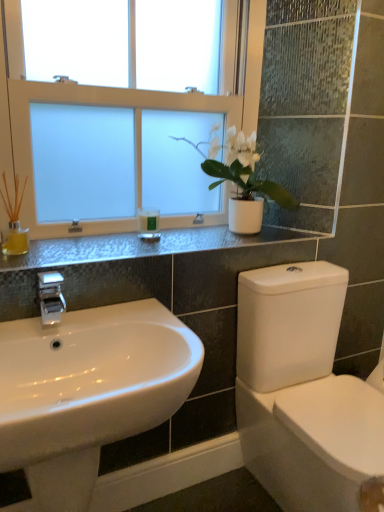
Find the location of a particular element. The image size is (384, 512). free location to the right of green matte candle at center is located at coordinates (200, 242).